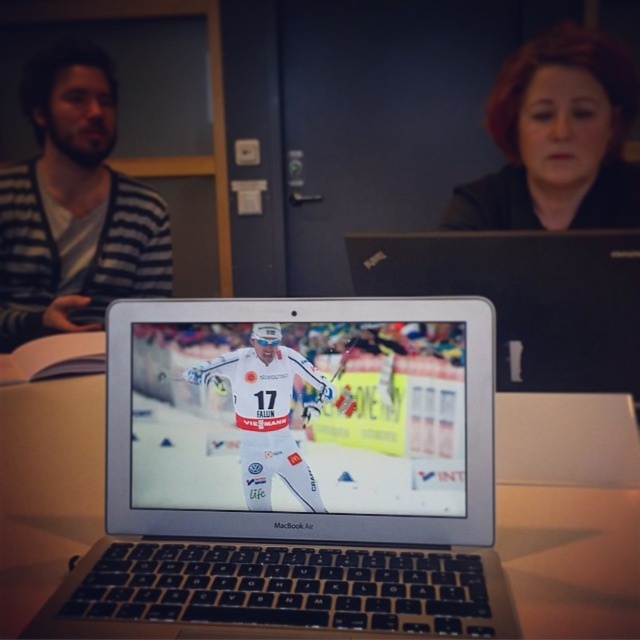
Question: Which object appears closest to the camera in this image?

Choices:
 (A) smooth black hair at upper right
 (B) striped sweater at left
 (C) silver metallic laptop at center

Answer: (C)

Question: Is silver metallic laptop at center positioned before striped sweater at left?

Choices:
 (A) no
 (B) yes

Answer: (B)

Question: Based on their relative distances, which object is farther from the smooth black hair at upper right?

Choices:
 (A) striped sweater at left
 (B) silver metallic laptop at center

Answer: (B)

Question: Considering the real-world distances, which object is farthest from the silver metallic laptop at center?

Choices:
 (A) striped sweater at left
 (B) smooth black hair at upper right

Answer: (B)

Question: Does striped sweater at left have a larger size compared to smooth black hair at upper right?

Choices:
 (A) no
 (B) yes

Answer: (B)

Question: Can you confirm if striped sweater at left is bigger than smooth black hair at upper right?

Choices:
 (A) yes
 (B) no

Answer: (A)